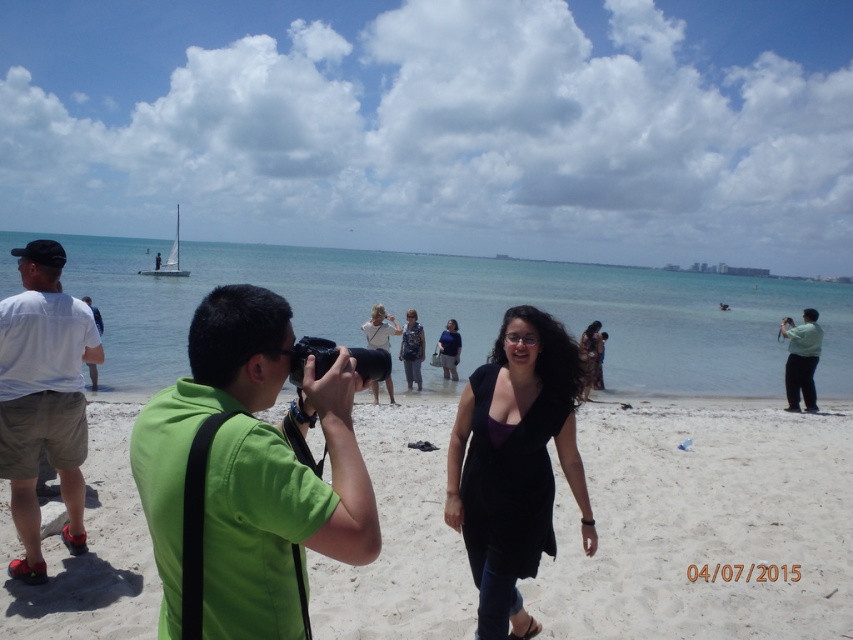
You are standing at the point labeled as point (704, 524). Which part of the beach are you currently on?

You are on the white sandy beach at center.

You are a photographer standing at the center of the beach. You want to take a photo of both the dark blue dress at center and the matte white shirt at left. The camera can focus on objects within a 5 meter range. Will both subjects be in focus?

The dark blue dress at center is 7.12 meters from matte white shirt at left. Since the distance between them is greater than 5 meters, the camera cannot focus on both subjects simultaneously within the 5 meter range.